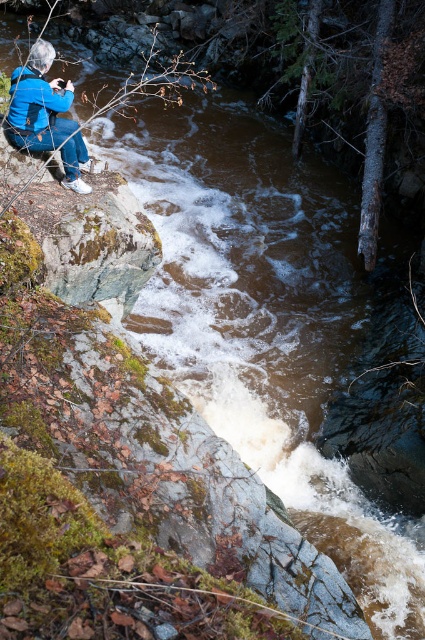
What do you see at coordinates (45, 115) in the screenshot? The height and width of the screenshot is (640, 425). I see `blue fabric jacket at upper left` at bounding box center [45, 115].

Is blue fabric jacket at upper left in front of blue matte jacket at upper left?

That is True.

Does point (28, 106) come closer to viewer compared to point (25, 97)?

No, (28, 106) is further to viewer.

This screenshot has height=640, width=425. I want to click on blue fabric jacket at upper left, so click(x=45, y=115).